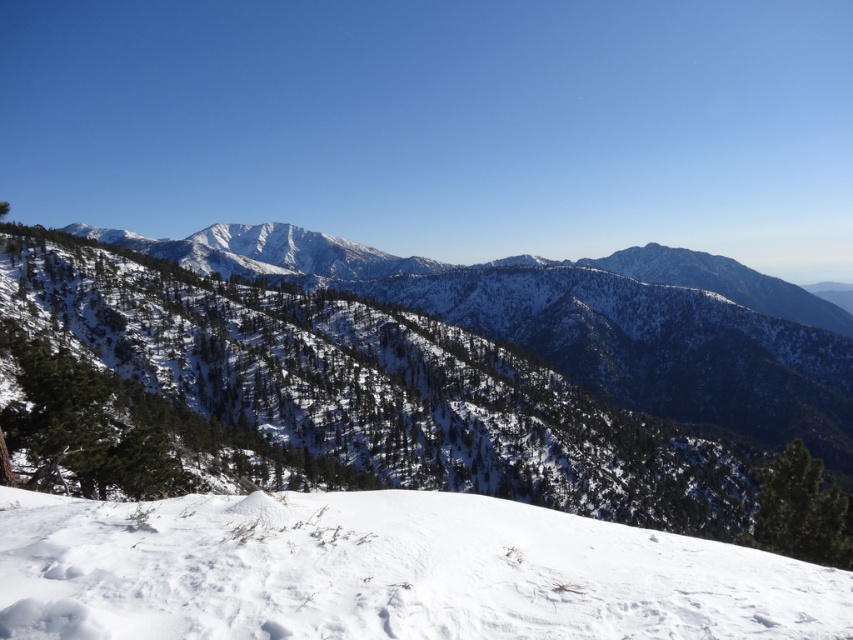
You are standing at the base of the snowy hill and want to reach a point that is behind both point (x=722, y=628) and point (x=747, y=509). Which point should you pass first on your way to your destination?

You should pass point (x=722, y=628) first because it is in front of point (x=747, y=509), so you must go past it before reaching the point behind both.

You are standing at the point marked as point (x=387, y=572) in the image. What is the terrain like at your current location?

The terrain at point (x=387, y=572) is white snow at lower center.